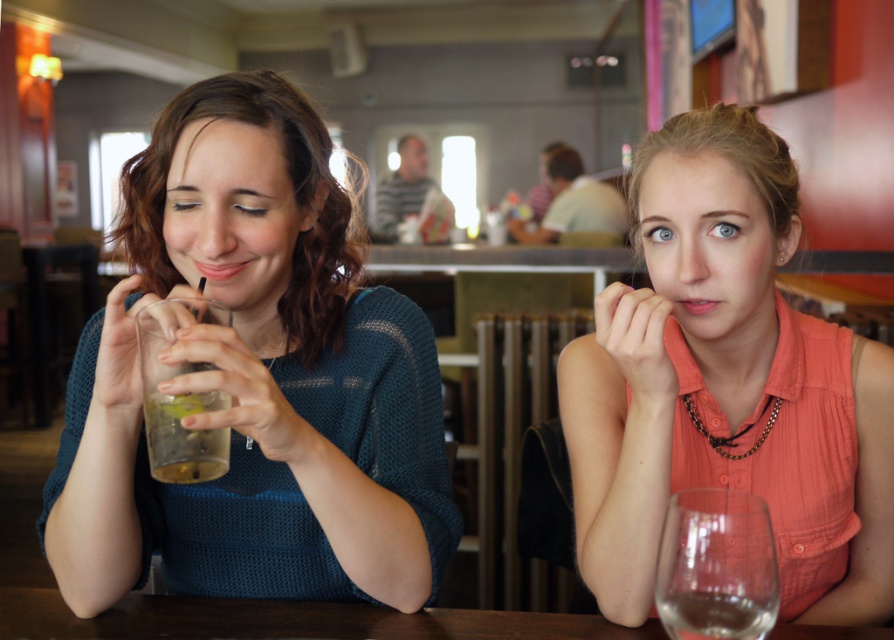
How distant is clear glass at left from clear glass wine at right?

clear glass at left and clear glass wine at right are 15.76 inches apart from each other.

In the scene shown: Is clear glass at left positioned at the back of clear glass wine at right?

That is True.

Between point (154, 413) and point (735, 618), which one is positioned behind?

The point (154, 413) is more distant.

This screenshot has width=894, height=640. Find the location of `clear glass at left`. clear glass at left is located at coordinates (184, 436).

Is point (706, 589) closer to viewer compared to point (723, 442)?

Yes, point (706, 589) is in front of point (723, 442).

Between point (701, 602) and point (777, 403), which one is positioned behind?

Positioned behind is point (777, 403).

Which is behind, point (724, 616) or point (717, 444)?

Positioned behind is point (717, 444).

Image resolution: width=894 pixels, height=640 pixels. What are the coordinates of `clear glass wine at right` in the screenshot? It's located at (714, 616).

Is clear glass at left closer to camera compared to gold metallic necklace at center?

That is True.

Is point (170, 461) positioned after point (690, 406)?

No.

Identify the location of clear glass at left. (184, 436).